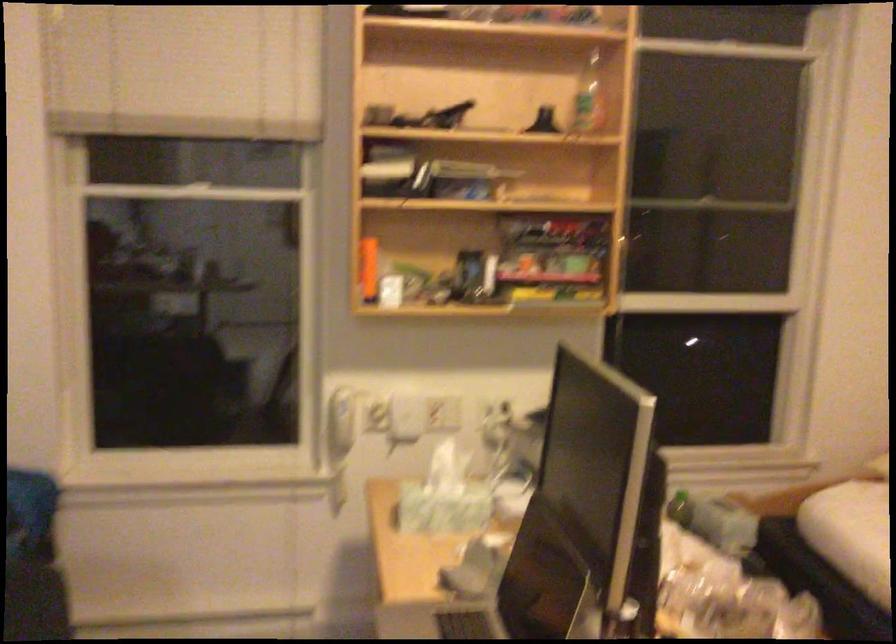
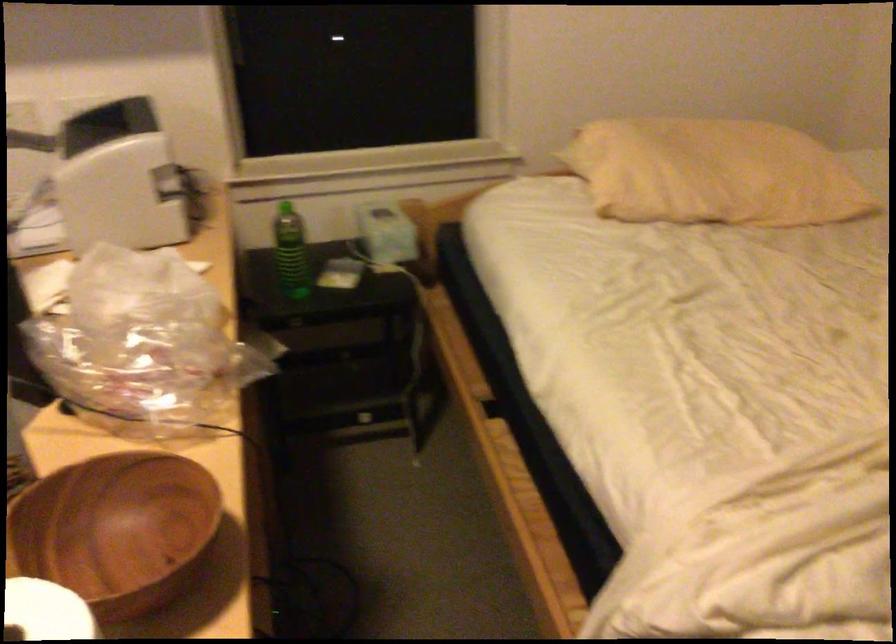
Locate, in the second image, the point that corresponds to pixel 736 518 in the first image.

(385, 232)